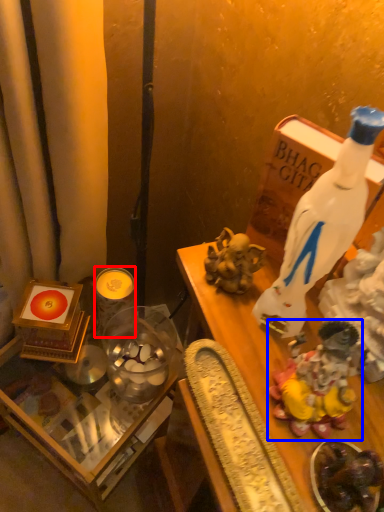
Question: Which object appears farthest to the camera in this image, candle (highlighted by a red box) or toy (highlighted by a blue box)?

Choices:
 (A) candle
 (B) toy

Answer: (A)